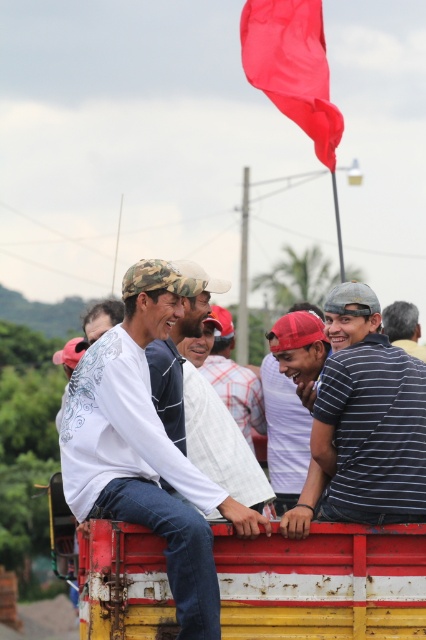
Between white cotton shirt at center and gray striped shirt at upper right, which one is positioned lower?

white cotton shirt at center is below.

Is point (230, 380) farther from camera compared to point (412, 348)?

Yes, point (230, 380) is behind point (412, 348).

At what (x,y) coordinates should I click in order to perform the action: click on white cotton shirt at center. Please return your answer as a coordinate pair (x, y). The height and width of the screenshot is (640, 426). Looking at the image, I should click on (235, 380).

Does striped cotton shirt at center appear on the left side of smooth fabric flag at upper center?

Correct, you'll find striped cotton shirt at center to the left of smooth fabric flag at upper center.

Does striped cotton shirt at center have a smaller size compared to smooth fabric flag at upper center?

Yes.

Measure the distance between striped cotton shirt at center and camera.

A distance of 36.50 feet exists between striped cotton shirt at center and camera.

Find the location of a particular element. This screenshot has width=426, height=640. striped cotton shirt at center is located at coordinates (363, 422).

Who is more distant from viewer, (x=383, y=518) or (x=233, y=380)?

The point (x=233, y=380) is more distant.

Between striped cotton shirt at center and white cotton shirt at center, which one has less height?

striped cotton shirt at center is shorter.

Locate an element on the screen. Image resolution: width=426 pixels, height=640 pixels. striped cotton shirt at center is located at coordinates (363, 422).

The height and width of the screenshot is (640, 426). In order to click on striped cotton shirt at center in this screenshot , I will do `click(363, 422)`.